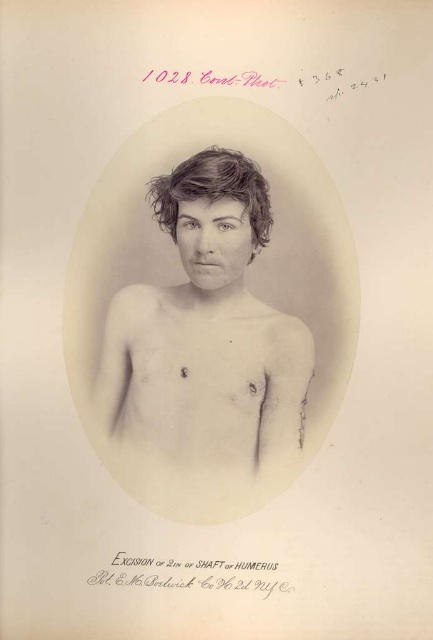
Can you confirm if smooth skin torso at center is shorter than dark brown wavy hair at center?

No, smooth skin torso at center is not shorter than dark brown wavy hair at center.

Which is more to the right, smooth skin torso at center or dark brown wavy hair at center?

Positioned to the right is dark brown wavy hair at center.

Identify the location of smooth skin torso at center. (206, 332).